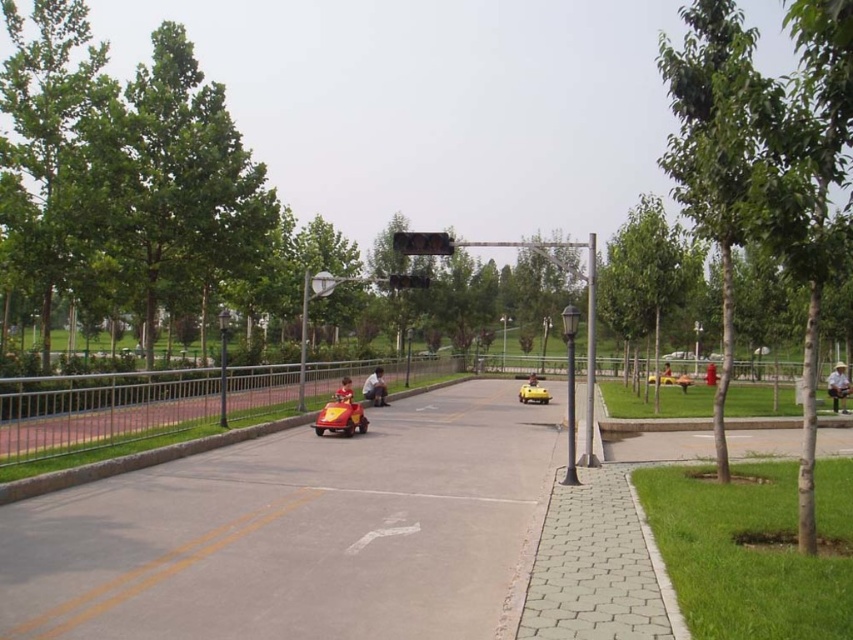
Question: From the image, what is the correct spatial relationship of smooth red car at center in relation to yellow matte toy car at center?

Choices:
 (A) left
 (B) right

Answer: (A)

Question: Does smooth red car at center have a lesser width compared to yellow fabric child at center?

Choices:
 (A) yes
 (B) no

Answer: (A)

Question: Which point is farther to the camera?

Choices:
 (A) (328, 410)
 (B) (840, 396)

Answer: (B)

Question: Which point is closer to the camera?

Choices:
 (A) (376, 384)
 (B) (316, 420)
 (C) (62, 598)
 (D) (343, 387)

Answer: (C)

Question: Which of the following is the farthest from the observer?

Choices:
 (A) smooth red car at center
 (B) matte red go-kart at center
 (C) yellow fabric child at center
 (D) yellow matte toy car at center

Answer: (C)

Question: Does yellow matte toy car at center appear under matte red go-kart at center?

Choices:
 (A) no
 (B) yes

Answer: (B)